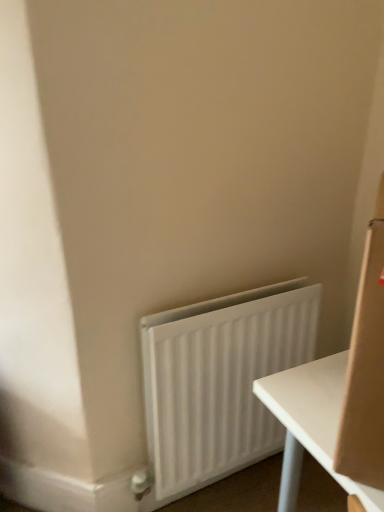
At what (x,y) coordinates should I click in order to perform the action: click on white matte radiator at lower right. Please return your answer as a coordinate pair (x, y). Looking at the image, I should click on click(x=220, y=381).

This screenshot has height=512, width=384. Describe the element at coordinates (220, 381) in the screenshot. I see `white matte radiator at lower right` at that location.

Measure the distance between white matte radiator at lower right and camera.

white matte radiator at lower right is 3.93 feet from camera.

In the scene shown: In order to face white matte radiator at lower right, should I rotate leftwards or rightwards?

To face it directly, rotate right by 5.448 degrees.

Find the location of a particular element. white matte radiator at lower right is located at coordinates (220, 381).